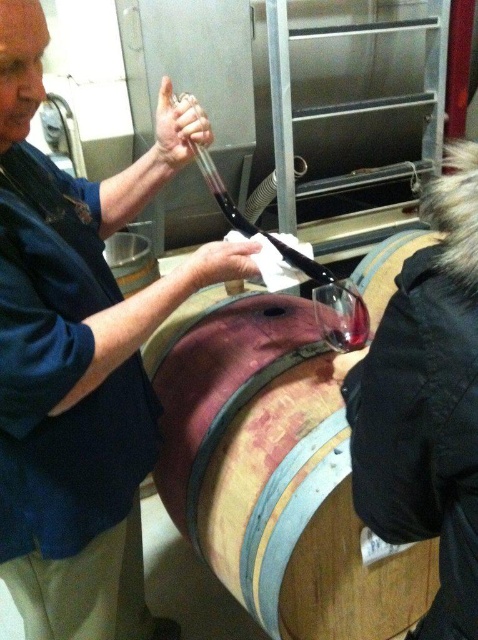
Question: Is black fabric at upper right wider than transparent glass at center?

Choices:
 (A) no
 (B) yes

Answer: (B)

Question: Which of the following is the farthest from the observer?

Choices:
 (A) (337, 349)
 (B) (74, 246)
 (C) (358, 346)
 (D) (400, 346)

Answer: (A)

Question: Does black fabric at upper right appear under transparent glass at center?

Choices:
 (A) no
 (B) yes

Answer: (B)

Question: Which object is farther from the camera taking this photo?

Choices:
 (A) wooden barrel at center
 (B) translucent glass wine at center

Answer: (B)

Question: Which point is closer to the camera?

Choices:
 (A) black fabric at upper right
 (B) transparent glass at center

Answer: (A)

Question: From the image, what is the correct spatial relationship of wooden barrel at center in relation to translucent glass wine at center?

Choices:
 (A) above
 (B) below

Answer: (B)